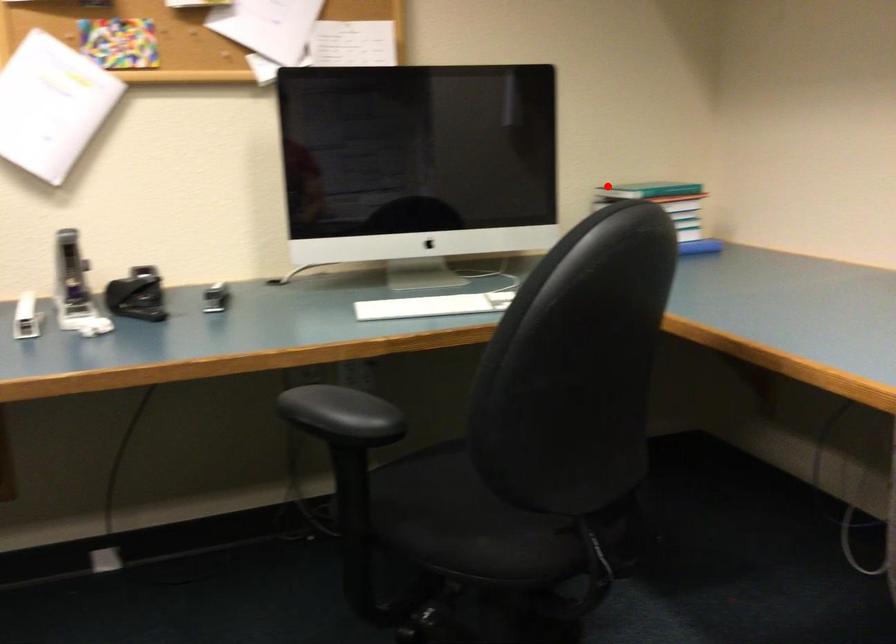
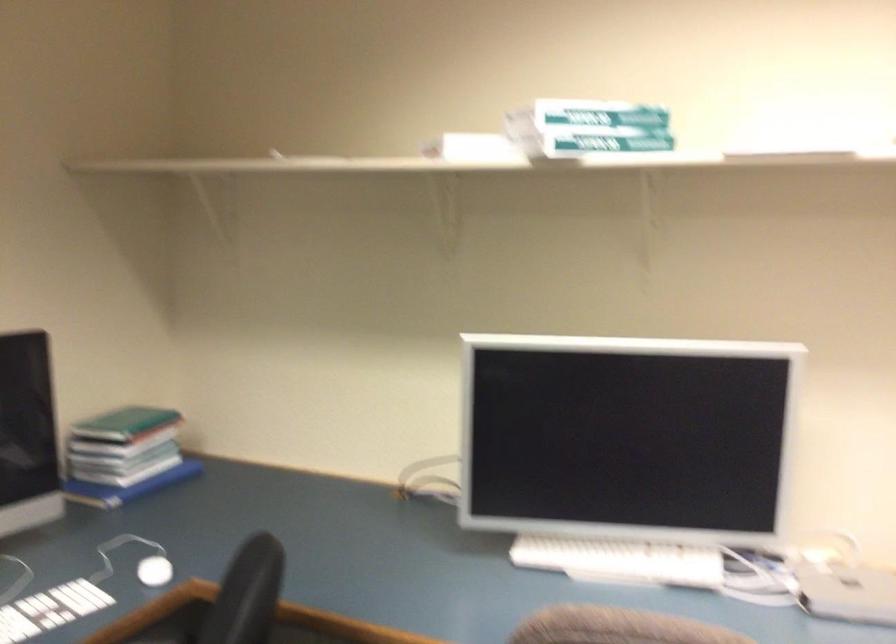
In the second image, find the point that corresponds to the highlighted location in the first image.

(124, 422)